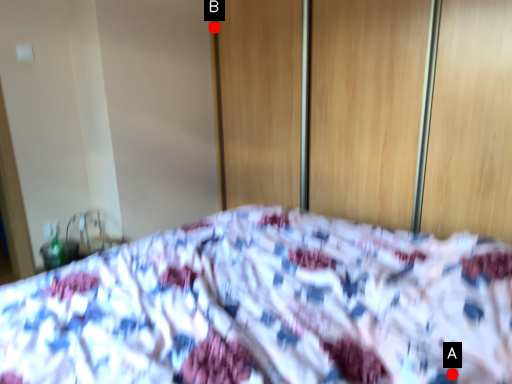
Question: Two points are circled on the image, labeled by A and B beside each circle. Which point appears closest to the camera in this image?

Choices:
 (A) A is closer
 (B) B is closer

Answer: (A)